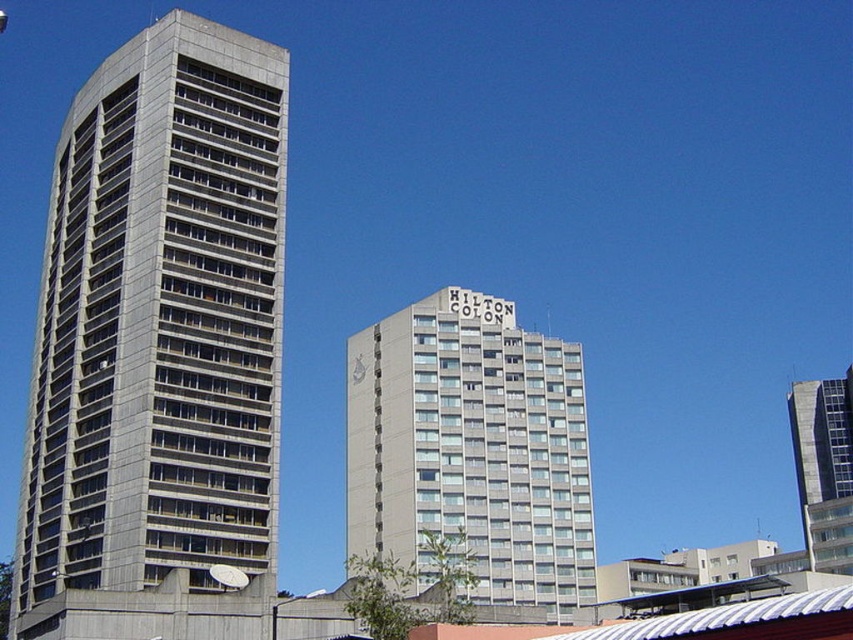
You are a city planner assessing the space between two buildings. The gray metallic building at left and the gray concrete building at right are both in your view. Considering their widths, which building would require more horizontal space if you were to replicate their designs in a model? Explain your reasoning based on their dimensions.

The gray concrete building at right requires more horizontal space because it has a greater width than the gray metallic building at left according to the description.

You are standing in front of the two gray concrete buildings. The gray concrete building at center and the gray concrete building at right are both in front of you. Which building is positioned to the left side?

The gray concrete building at center is positioned to the left of the gray concrete building at right.

You are an urban planner analyzing the city layout. You need to determine which building takes up more area on the map. Based on the scene, which building between the gray metallic building at left and the gray concrete building at right covers a larger area?

The gray concrete building at right covers a larger area than the gray metallic building at left because it occupies more space according to the description.